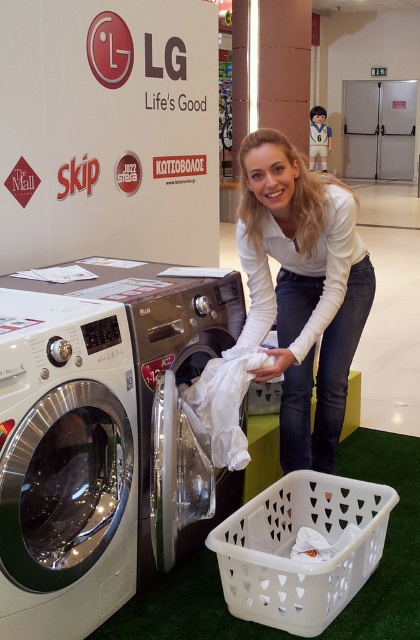
Question: Is white glossy washing machine at lower left closer to camera compared to white fabric at lower center?

Choices:
 (A) yes
 (B) no

Answer: (A)

Question: Which of the following is the closest to the observer?

Choices:
 (A) (220, 433)
 (B) (133, 365)
 (C) (312, 264)

Answer: (B)

Question: Which point is farther from the camera taking this photo?

Choices:
 (A) (367, 289)
 (B) (233, 464)
 (C) (125, 477)
 (D) (139, 387)

Answer: (A)

Question: Does white plastic laundry basket at lower center have a larger size compared to white glossy washing machine at center?

Choices:
 (A) no
 (B) yes

Answer: (A)

Question: Among these points, which one is farthest from the camera?

Choices:
 (A) (21, 528)
 (B) (344, 508)
 (C) (184, 353)

Answer: (B)

Question: Can you confirm if white plastic laundry basket at lower center is positioned to the right of white glossy washing machine at center?

Choices:
 (A) yes
 (B) no

Answer: (A)